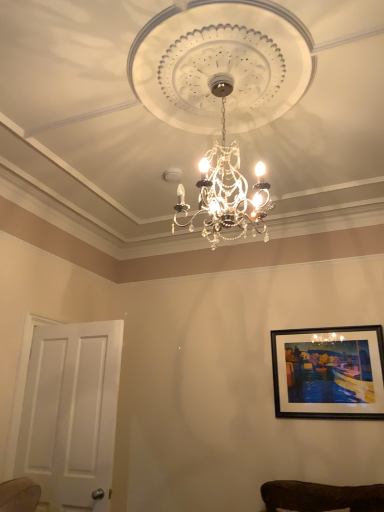
What do you see at coordinates (71, 414) in the screenshot?
I see `white matte door at left` at bounding box center [71, 414].

Measure the distance between white matte door at left and camera.

A distance of 2.73 meters exists between white matte door at left and camera.

Where is `crystal glass chandelier at center`? Image resolution: width=384 pixels, height=512 pixels. crystal glass chandelier at center is located at coordinates (225, 185).

Between black matte picture frame at upper right and white matte door at left, which one is positioned in front?

white matte door at left is in front.

Could you tell me if black matte picture frame at upper right is facing white matte door at left?

No, black matte picture frame at upper right does not turn towards white matte door at left.

Do you think black matte picture frame at upper right is within white matte door at left, or outside of it?

black matte picture frame at upper right cannot be found inside white matte door at left.

Does point (307, 416) come closer to viewer compared to point (105, 370)?

No, (307, 416) is behind (105, 370).

Is white matte door at left taller or shorter than crystal glass chandelier at center?

Considering their sizes, white matte door at left has more height than crystal glass chandelier at center.

Who is bigger, white matte door at left or crystal glass chandelier at center?

crystal glass chandelier at center is bigger.

From a real-world perspective, between white matte door at left and crystal glass chandelier at center, who is vertically lower?

In real-world perspective, white matte door at left is lower.

Can you confirm if white matte door at left is positioned to the left of crystal glass chandelier at center?

Yes, white matte door at left is to the left of crystal glass chandelier at center.

Does black matte picture frame at upper right have a smaller size compared to crystal glass chandelier at center?

Indeed, black matte picture frame at upper right has a smaller size compared to crystal glass chandelier at center.

How far apart are black matte picture frame at upper right and crystal glass chandelier at center?

black matte picture frame at upper right and crystal glass chandelier at center are 1.62 meters apart from each other.

Is black matte picture frame at upper right turned away from crystal glass chandelier at center?

No, black matte picture frame at upper right is not facing the opposite direction of crystal glass chandelier at center.

Considering the positions of point (196, 184) and point (38, 369), is point (196, 184) closer or farther from the camera than point (38, 369)?

Point (196, 184) is closer to the camera than point (38, 369).

What's the angular difference between crystal glass chandelier at center and white matte door at left's facing directions?

crystal glass chandelier at center and white matte door at left are facing 90.3 degrees away from each other.

Which of these two, crystal glass chandelier at center or white matte door at left, stands taller?

Standing taller between the two is white matte door at left.

Is crystal glass chandelier at center not close to black matte picture frame at upper right?

→ crystal glass chandelier at center is far away from black matte picture frame at upper right.

From the image's perspective, is crystal glass chandelier at center located above black matte picture frame at upper right?

Yes, from the image's perspective, crystal glass chandelier at center is over black matte picture frame at upper right.

In the image, is crystal glass chandelier at center positioned in front of or behind black matte picture frame at upper right?

crystal glass chandelier at center is in front of black matte picture frame at upper right.

Consider the image. From a real-world perspective, is crystal glass chandelier at center on top of black matte picture frame at upper right?

Correct, in the physical world, crystal glass chandelier at center is higher than black matte picture frame at upper right.

Can you confirm if white matte door at left is positioned to the right of black matte picture frame at upper right?

No.

From a real-world perspective, does white matte door at left sit lower than black matte picture frame at upper right?

Correct, in the physical world, white matte door at left is lower than black matte picture frame at upper right.

Where is `door that is on the left side of black matte picture frame at upper right`? door that is on the left side of black matte picture frame at upper right is located at coordinates (71, 414).

Looking at their sizes, would you say white matte door at left is wider or thinner than black matte picture frame at upper right?

white matte door at left is wider than black matte picture frame at upper right.

This screenshot has height=512, width=384. Identify the location of picture frame above the white matte door at left (from the image's perspective). (329, 373).

Identify the location of door that is under the crystal glass chandelier at center (from a real-world perspective). (71, 414).

From the image, which object appears to be nearer to black matte picture frame at upper right, crystal glass chandelier at center or white matte door at left?

crystal glass chandelier at center is closer to black matte picture frame at upper right.

Estimate the real-world distances between objects in this image. Which object is closer to white matte door at left, crystal glass chandelier at center or black matte picture frame at upper right?

crystal glass chandelier at center is closer to white matte door at left.

Based on their spatial positions, is white matte door at left or crystal glass chandelier at center closer to black matte picture frame at upper right?

crystal glass chandelier at center lies closer to black matte picture frame at upper right than the other object.

Considering their positions, is black matte picture frame at upper right positioned further to crystal glass chandelier at center than white matte door at left?

Based on the image, black matte picture frame at upper right appears to be further to crystal glass chandelier at center.

Which object lies further to the anchor point crystal glass chandelier at center, white matte door at left or black matte picture frame at upper right?

black matte picture frame at upper right lies further to crystal glass chandelier at center than the other object.

Based on their spatial positions, is black matte picture frame at upper right or crystal glass chandelier at center closer to white matte door at left?

crystal glass chandelier at center.

Identify the location of lamp located between white matte door at left and black matte picture frame at upper right in the left-right direction. This screenshot has height=512, width=384. (225, 185).